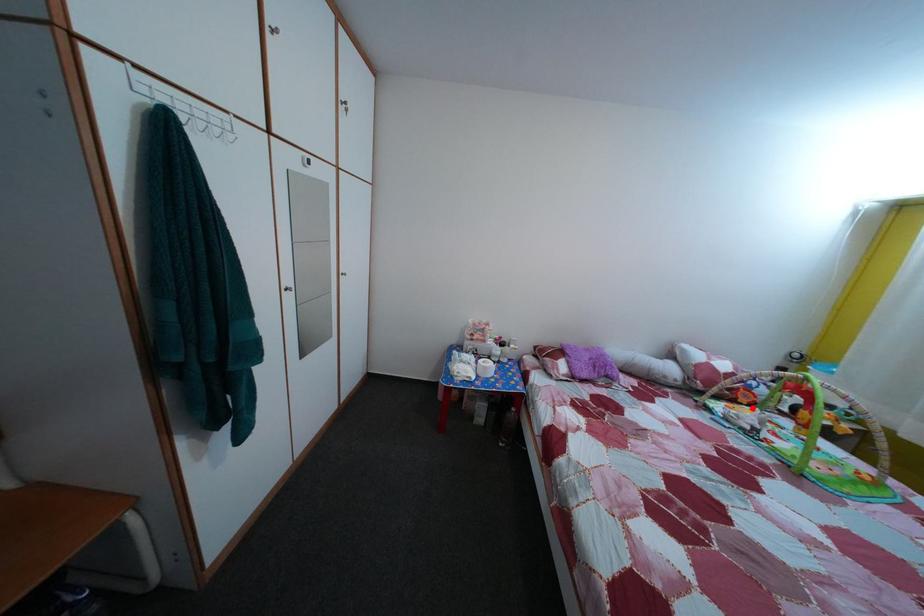
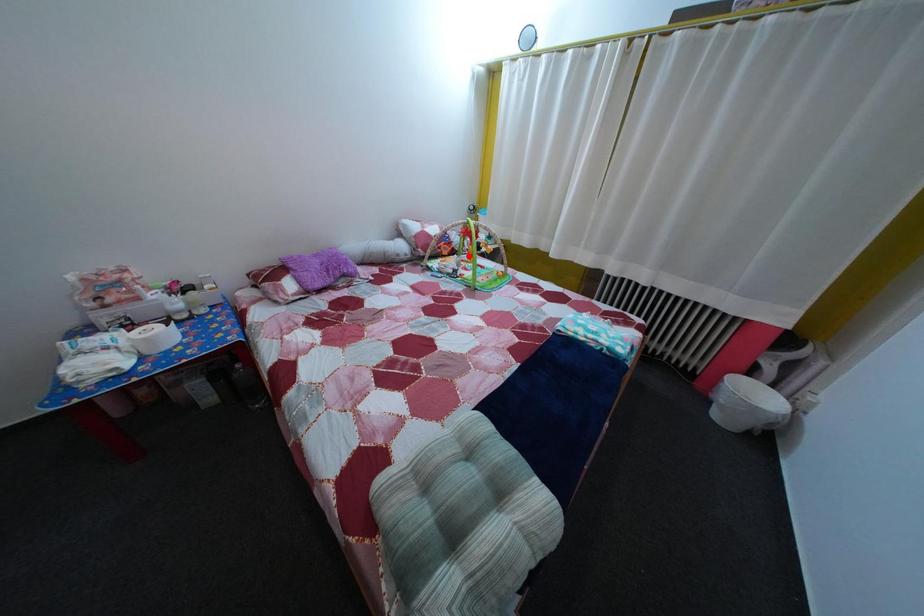
I am providing you with two images of the same scene from different viewpoints. A red point is marked on the first image and another point is marked on the second image. Is the marked point in image1 the same physical position as the marked point in image2?

No